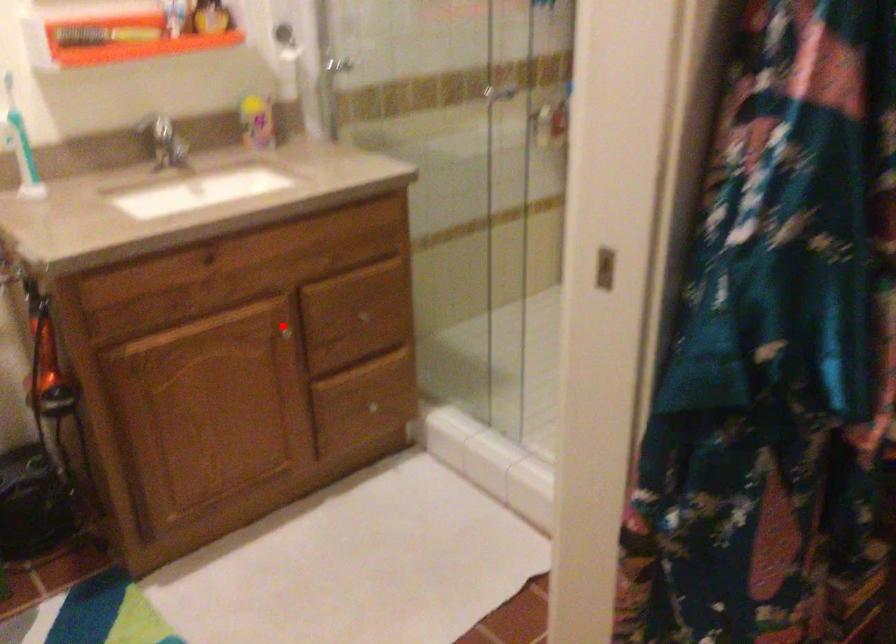
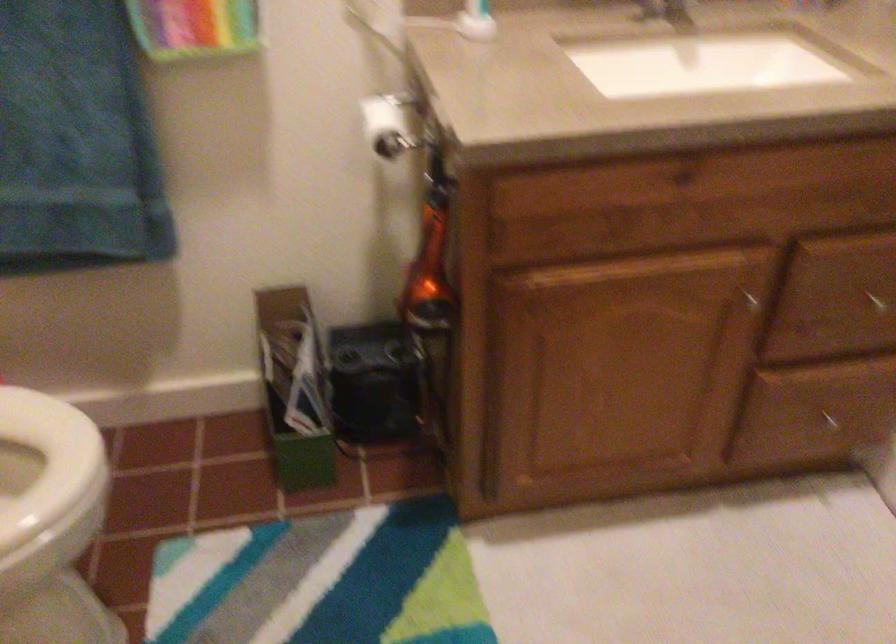
Question: I am providing you with two images of the same scene from different viewpoints. In image1, a red point is highlighted. Considering the same 3D point in image2, which of the following is correct?

Choices:
 (A) It is closer
 (B) It is farther

Answer: (A)